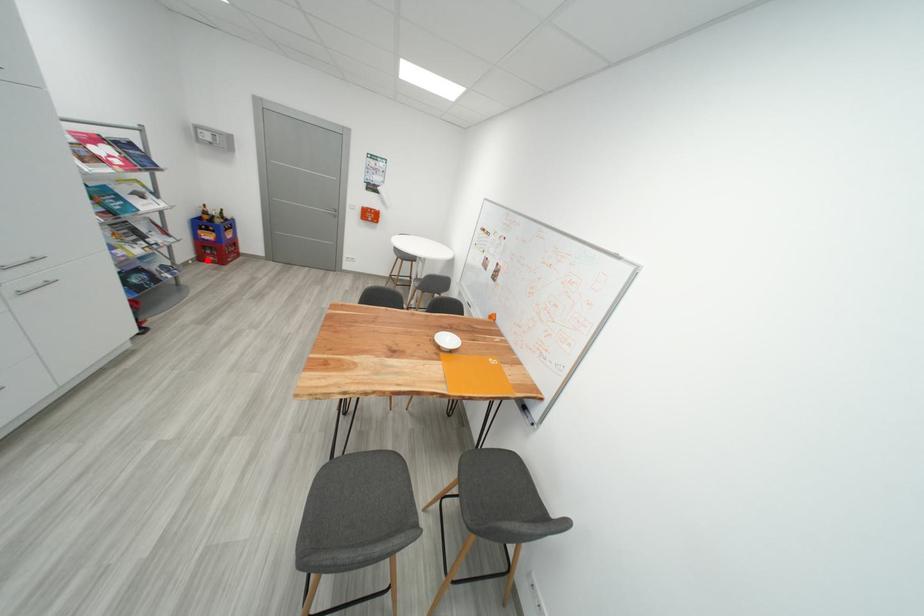
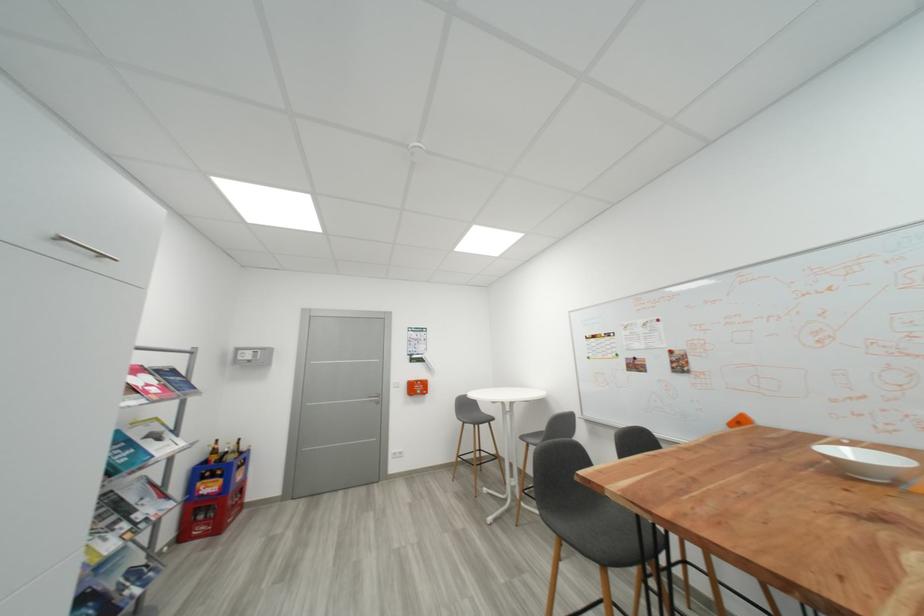
Question: I am providing you with two images of the same scene from different viewpoints. A red point is shown in image1. For the corresponding object point in image2, is it positioned nearer or farther from the camera?

Choices:
 (A) Nearer
 (B) Farther

Answer: (B)